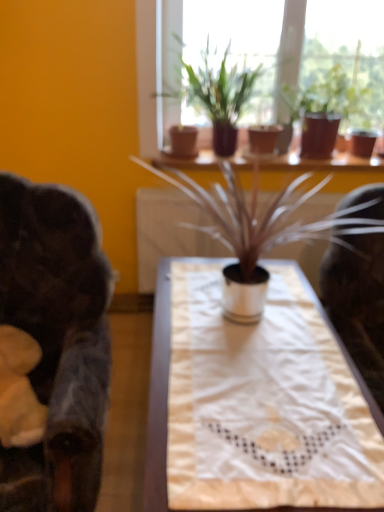
Question: Is point (74, 209) positioned closer to the camera than point (329, 327)?

Choices:
 (A) closer
 (B) farther

Answer: (B)

Question: Is dark brown leather rocking chair at left inside or outside of white fabric table at center?

Choices:
 (A) outside
 (B) inside

Answer: (A)

Question: Based on their relative distances, which object is nearer to the dark brown leather rocking chair at left?

Choices:
 (A) white fabric table at center
 (B) white metallic pot at center, the third houseplant from the back
 (C) matte brown pots at upper center
 (D) matte brown pot at upper center, positioned as the second houseplant in back-to-front order
 (E) matte brown pot at upper center, which is the 3th houseplant in front-to-back order

Answer: (A)

Question: Estimate the real-world distances between objects in this image. Which object is farther from the white metallic pot at center, the third houseplant from the back?

Choices:
 (A) matte brown pot at upper center, positioned as the second houseplant in back-to-front order
 (B) matte brown pot at upper center, which is the 3th houseplant in front-to-back order
 (C) matte brown pots at upper center
 (D) white fabric table at center
 (E) dark brown leather rocking chair at left

Answer: (C)